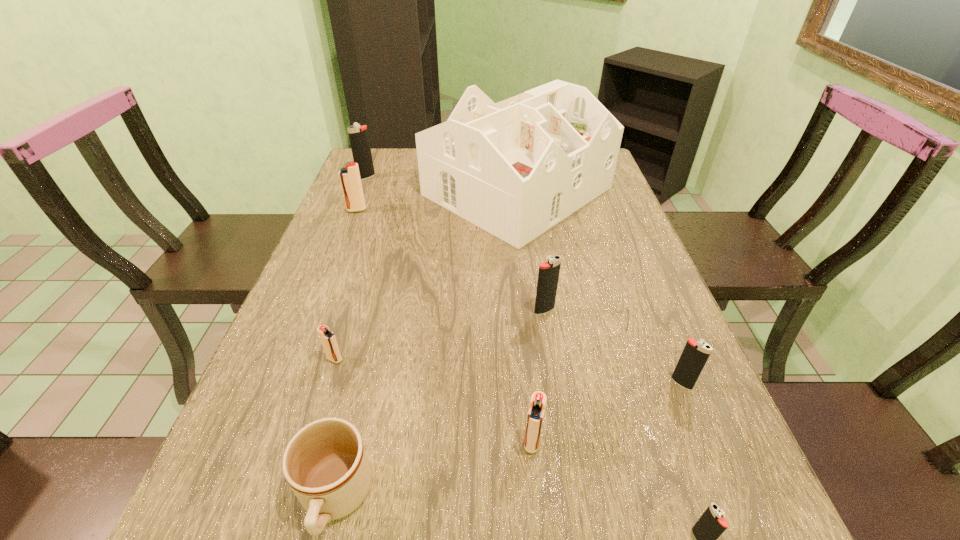
Where is `the second smallest red igniter`? This screenshot has width=960, height=540. the second smallest red igniter is located at coordinates (536, 411).

I want to click on the sixth farthest igniter, so click(x=536, y=411).

Image resolution: width=960 pixels, height=540 pixels. Find the location of `the second nearest red igniter`. the second nearest red igniter is located at coordinates [x=328, y=339].

Locate an element on the screen. The width and height of the screenshot is (960, 540). the fifth farthest object is located at coordinates (328, 339).

This screenshot has height=540, width=960. I want to click on free space located on the left of the dollhouse, so click(x=345, y=191).

You are a GUI agent. You are given a task and a screenshot of the screen. Output one action in this format:
    pyautogui.click(x=<x>, y=<y>)
    Task: Click on the vacant region located on the right of the leftmost black igniter
    The image size is (960, 540).
    Given the screenshot: What is the action you would take?
    pyautogui.click(x=481, y=177)

Where is `vacant space located 0.400m on the right of the second farthest igniter`? This screenshot has height=540, width=960. vacant space located 0.400m on the right of the second farthest igniter is located at coordinates [503, 210].

Find the location of a particular element. free spot located 0.190m on the front of the third nearest black igniter is located at coordinates (556, 388).

Find the location of a particular element. The height and width of the screenshot is (540, 960). vacant space situated 0.300m on the back of the second smallest black igniter is located at coordinates (637, 274).

Locate an element on the screen. free space located 0.400m on the left of the fourth igniter from left to right is located at coordinates (287, 442).